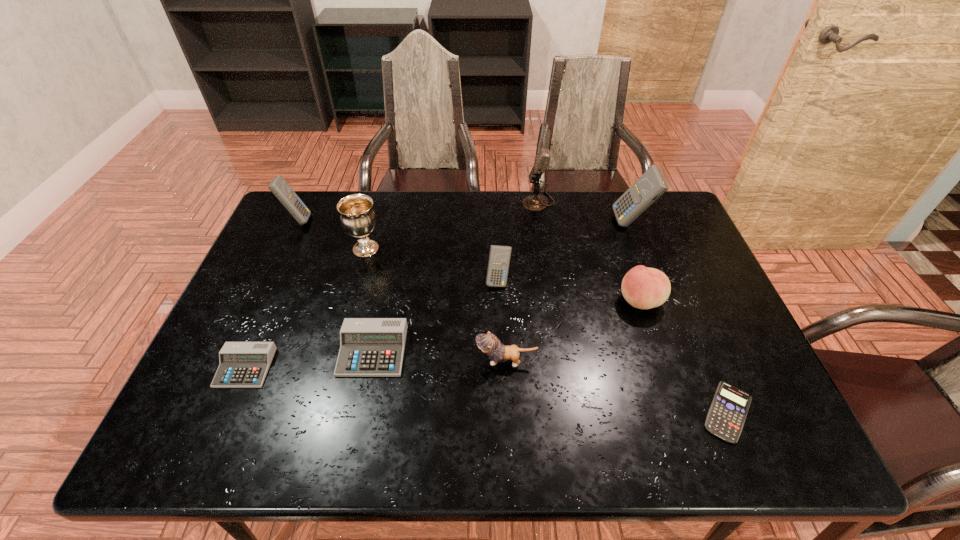
You are a GUI agent. You are given a task and a screenshot of the screen. Output one action in this format:
    pyautogui.click(x=<x>, y=<y>)
    Task: Click on the vacant area that lies between the fourth calculator from left to right and the chalice
    The width and height of the screenshot is (960, 540).
    Given the screenshot: What is the action you would take?
    pyautogui.click(x=432, y=265)

Locate an element on the screen. This screenshot has height=540, width=960. free space between the shortest object and the third calculator from right to left is located at coordinates (613, 346).

Identify the location of object that ranks as the third closest to the peach. (488, 343).

Locate an element on the screen. object that ranks as the fifth closest to the bigger gray calculator is located at coordinates (279, 187).

You are a GUI agent. You are given a task and a screenshot of the screen. Output one action in this format:
    pyautogui.click(x=<x>, y=<y>)
    Task: Click on the calculator that is the fourth closest to the leftmost blue calculator
    
    Given the screenshot: What is the action you would take?
    pyautogui.click(x=651, y=185)

Point out which calculator is positioned as the nearest to the kitten. Please provide its 2D coordinates. Your answer should be formatted as a tuple, i.e. [(x, y)], where the tuple contains the x and y coordinates of a point satisfying the conditions above.

[(369, 347)]

You are a GUI agent. You are given a task and a screenshot of the screen. Output one action in this format:
    pyautogui.click(x=<x>, y=<y>)
    Task: Click on the blue calculator that is the second closest to the peach
    
    Given the screenshot: What is the action you would take?
    pyautogui.click(x=651, y=185)

You are a GUI agent. You are given a task and a screenshot of the screen. Output one action in this format:
    pyautogui.click(x=<x>, y=<y>)
    Task: Click on the second closest blue calculator to the leftmost blue calculator
    
    Given the screenshot: What is the action you would take?
    pyautogui.click(x=651, y=185)

At what (x,y) coordinates should I click in order to perform the action: click on free location that satisfies the following two spatial constraints: 1. on the front-facing side of the third smallest blue calculator; 2. on the left side of the fourth tallest calculator. Please return your answer as a coordinate pair (x, y). The height and width of the screenshot is (540, 960). Looking at the image, I should click on (238, 350).

Find the location of a particular element. free space that satisfies the following two spatial constraints: 1. on the front-facing side of the peach; 2. on the right side of the fourth object from right to left is located at coordinates (554, 301).